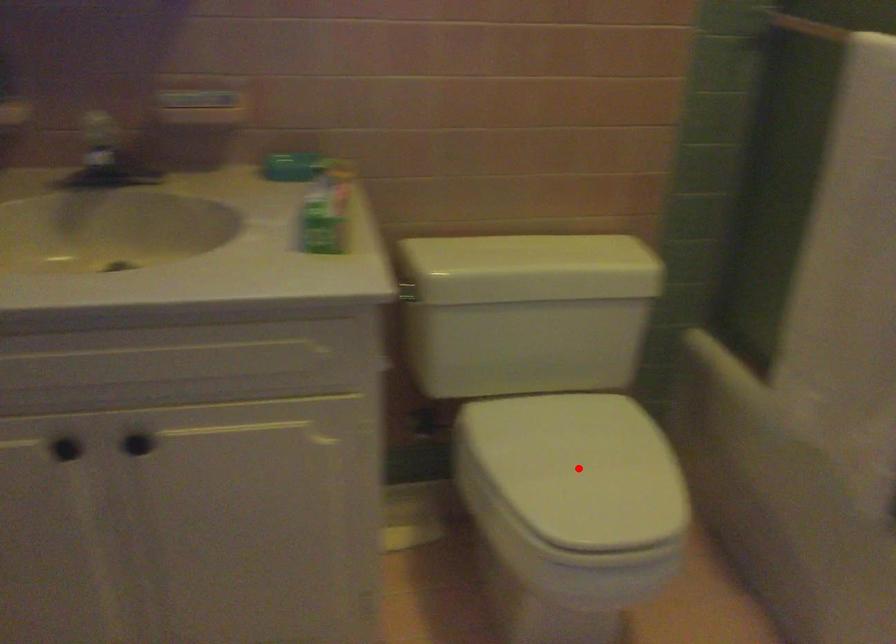
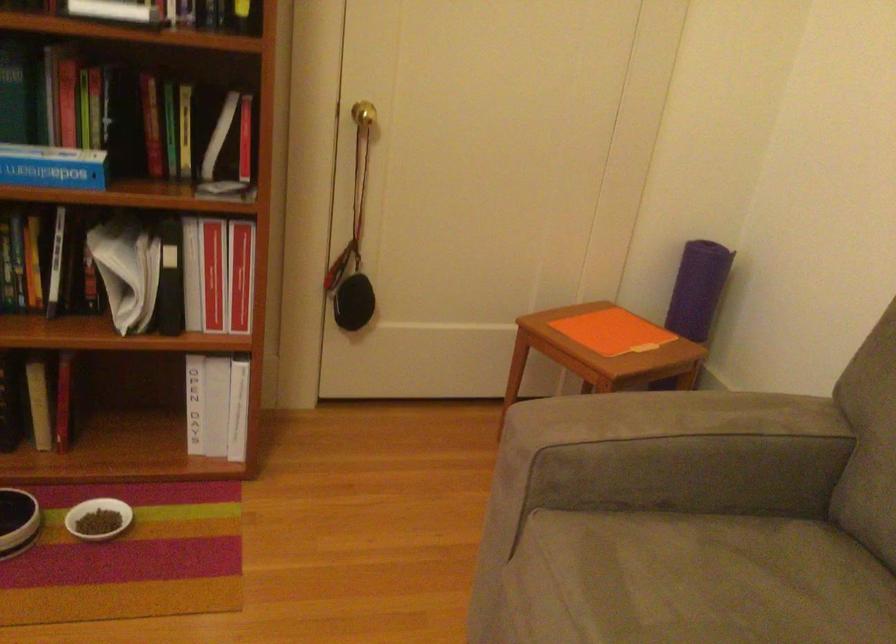
Question: I am providing you with two images of the same scene from different viewpoints. A red point is marked on the first image. Is the red point's position out of view in image 2?

Choices:
 (A) Yes
 (B) No

Answer: (A)